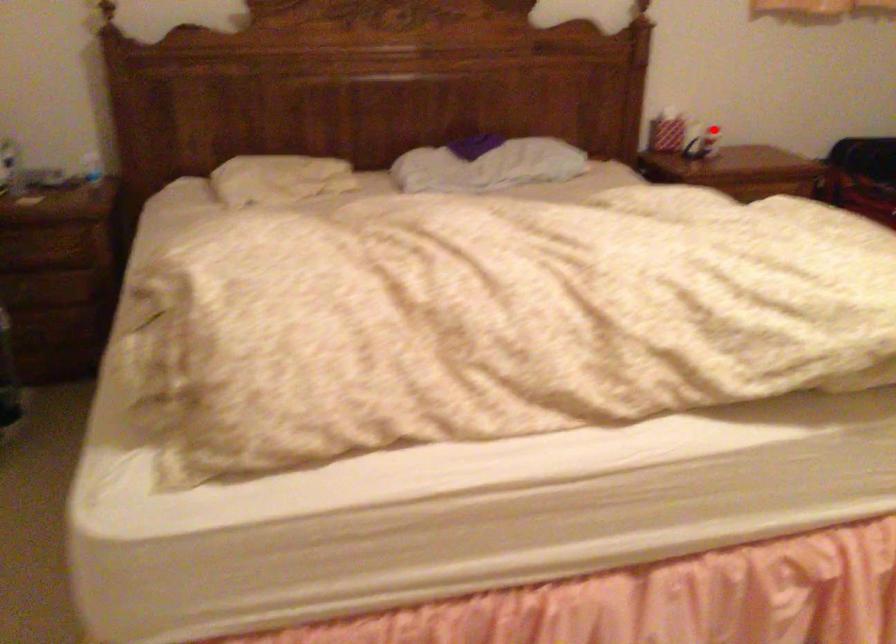
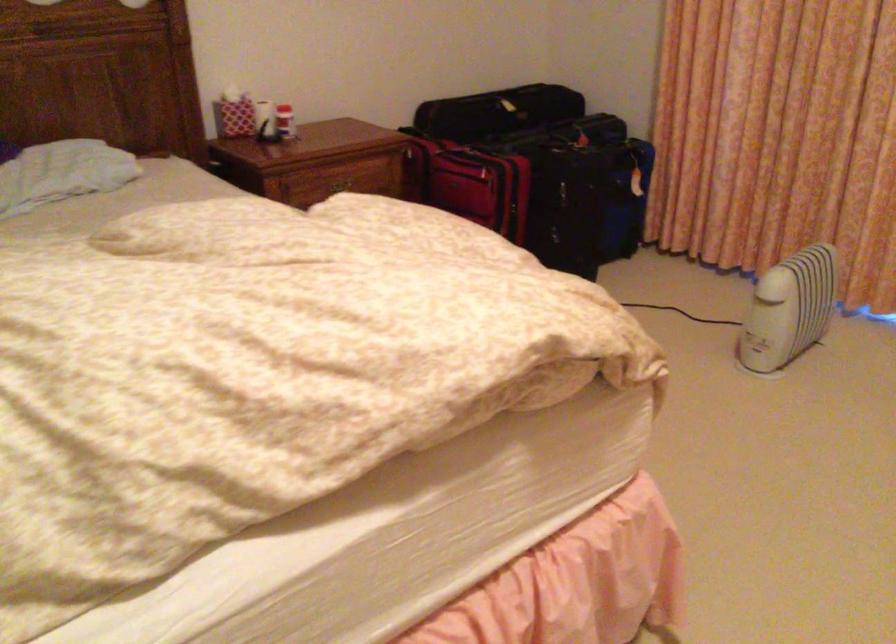
The point at the highlighted location is marked in the first image. Where is the corresponding point in the second image?

(285, 122)